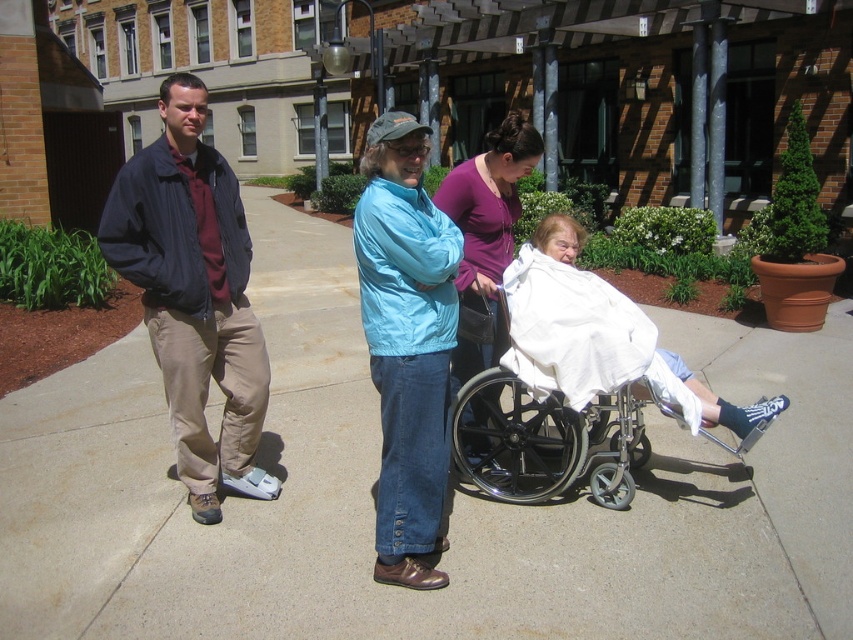
You are a delivery person trying to navigate a narrow path in the courtyard. The path is made of concrete at center and has a metallic silver wheelchair at center parked on it. Can you pass through the path without moving the wheelchair?

The concrete at center is larger in size than the metallic silver wheelchair at center, so there is enough space to pass through the path without moving the wheelchair.